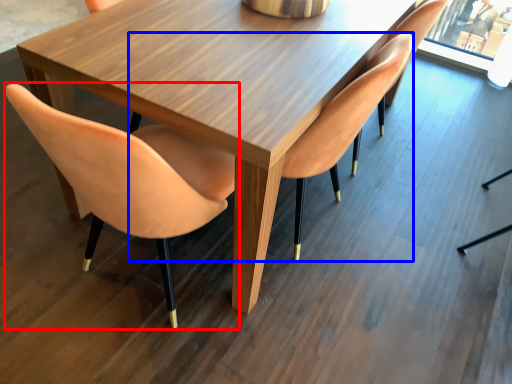
Question: Among these objects, which one is nearest to the camera, chair (highlighted by a red box) or chair (highlighted by a blue box)?

Choices:
 (A) chair
 (B) chair

Answer: (A)